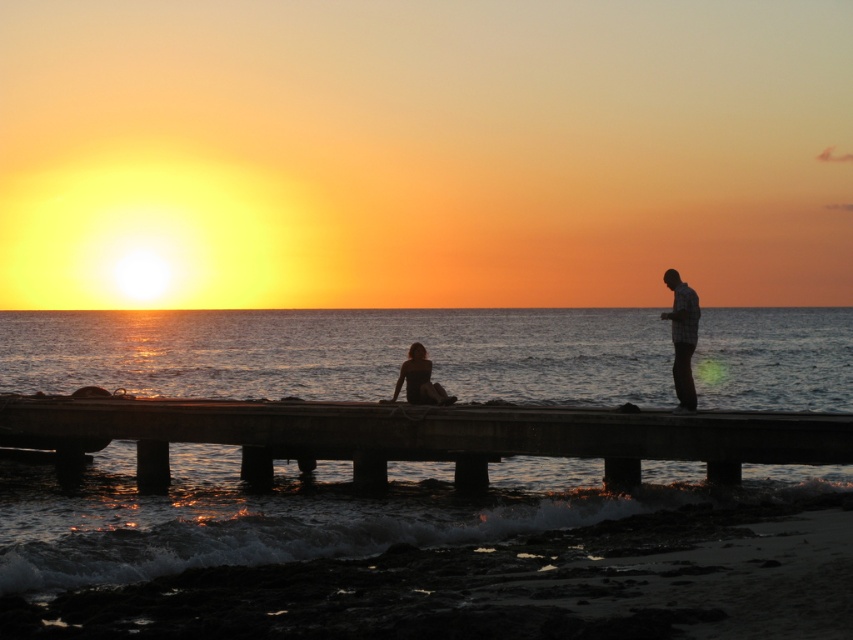
Looking at this image, does dark sand at lower center have a lesser height compared to concrete dock at center?

Indeed, dark sand at lower center has a lesser height compared to concrete dock at center.

Consider the image. Who is positioned more to the left, dark sand at lower center or concrete dock at center?

From the viewer's perspective, concrete dock at center appears more on the left side.

Identify the location of dark sand at lower center. (509, 584).

Image resolution: width=853 pixels, height=640 pixels. I want to click on dark sand at lower center, so click(509, 584).

Which of these two, shiny metallic water at center or dark sand at lower center, stands shorter?

dark sand at lower center

Is point (193, 474) positioned after point (627, 618)?

Yes, point (193, 474) is behind point (627, 618).

Identify the location of shiny metallic water at center. This screenshot has height=640, width=853. (281, 513).

Does shiny metallic water at center appear on the right side of plaid shirt at right?

In fact, shiny metallic water at center is to the left of plaid shirt at right.

Which is in front, point (303, 508) or point (691, 291)?

Point (303, 508)

The height and width of the screenshot is (640, 853). What are the coordinates of `shiny metallic water at center` in the screenshot? It's located at (281, 513).